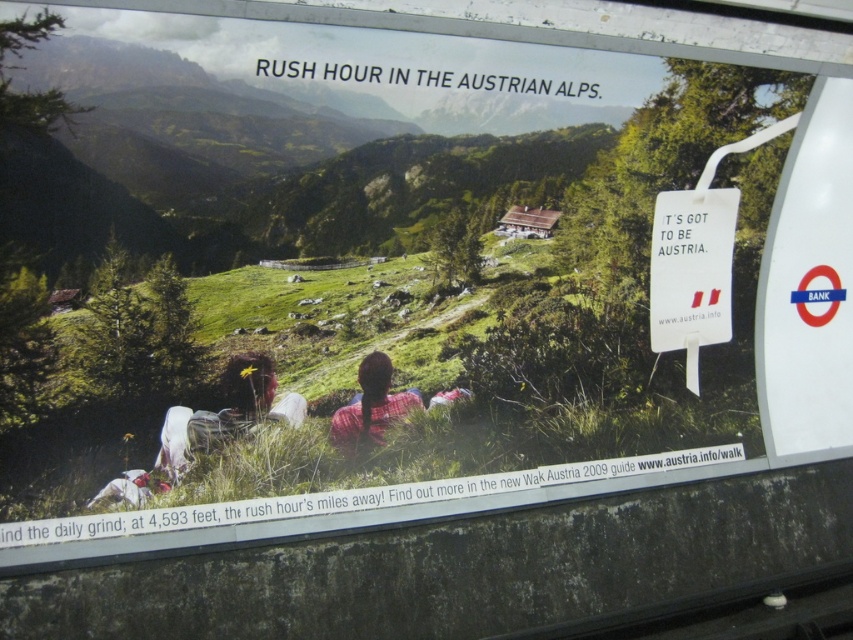
You are a photographer trying to capture a candid shot of the tourists in the Austrian Alps scene. You notice the matte black backpack at center and the plaid shirt at center. Which object is positioned higher in the image?

The matte black backpack at center is above the plaid shirt at center in the image.

You are a photographer trying to capture a candid shot of the plaid shirt at center without the backpack blocking the view. Based on the scene description, is the matte black backpack at center in the way of the shot?

The matte black backpack at center is closer to the viewer than the plaid shirt at center, so it would block the view of the plaid shirt at center.

You are a photographer planning to take a group photo of the three people seated on the grass. You need to ensure that both the matte black backpack at center and the plaid shirt at center are fully visible in the frame. Based on their sizes, which object should you position closer to the camera to avoid any overlap?

The matte black backpack at center is taller than the plaid shirt at center, so you should position the plaid shirt at center closer to the camera to prevent the taller backpack from blocking it.